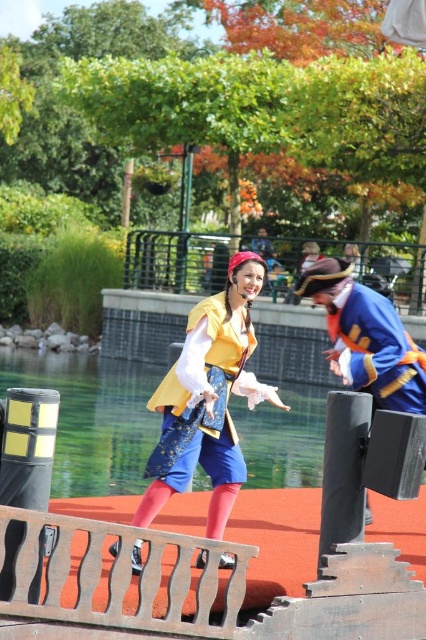
Question: Estimate the real-world distances between objects in this image. Which object is farther from the shiny gold vest at center?

Choices:
 (A) transparent blue water at center
 (B) blue satin pirate hat at right
 (C) matte yellow vest at center

Answer: (A)

Question: Which of the following is the farthest from the observer?

Choices:
 (A) (181, 456)
 (B) (340, 308)

Answer: (B)

Question: Is blue satin pirate hat at right below shiny gold vest at center?

Choices:
 (A) no
 (B) yes

Answer: (A)

Question: Is transparent blue water at center behind matte yellow vest at center?

Choices:
 (A) no
 (B) yes

Answer: (A)

Question: Is transparent blue water at center further to the viewer compared to matte yellow vest at center?

Choices:
 (A) no
 (B) yes

Answer: (A)

Question: Considering the real-world distances, which object is farthest from the matte yellow vest at center?

Choices:
 (A) shiny gold vest at center
 (B) blue satin pirate hat at right
 (C) transparent blue water at center

Answer: (C)